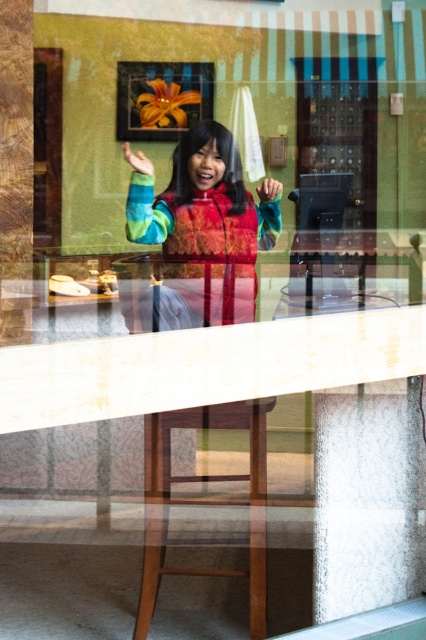
You are looking through the window and see two points marked in the scene. The first point is at coordinate point(262, 461) and the second is at point(144, 170). Which point is closer to you?

Point(262, 461) is in front of point(144, 170), so it is closer to you.

You are standing in the room and want to exit through the transparent glass door at center. To reach it, you need to move past the brown wooden stool at lower center. Which direction should you move relative to the stool?

You should move to the right of the brown wooden stool at lower center because the transparent glass door at center is located to its right side.

From the picture: You are a delivery person trying to place a package on the brown wooden stool at lower center. The transparent glass door at center is open. Can you directly place the package on the stool without moving the door?

The brown wooden stool at lower center is behind the transparent glass door at center. Since the door is open, you can directly place the package on the stool without needing to move the door.